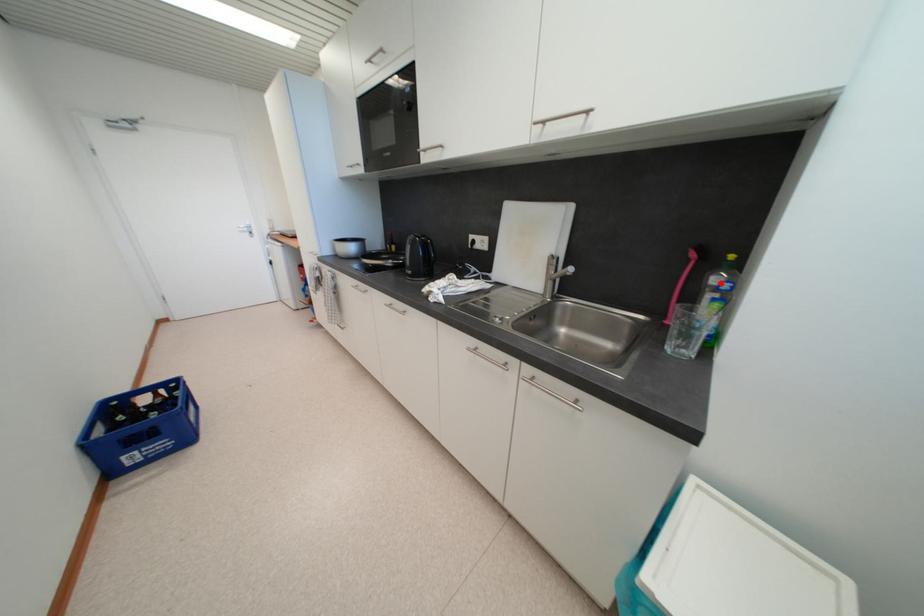
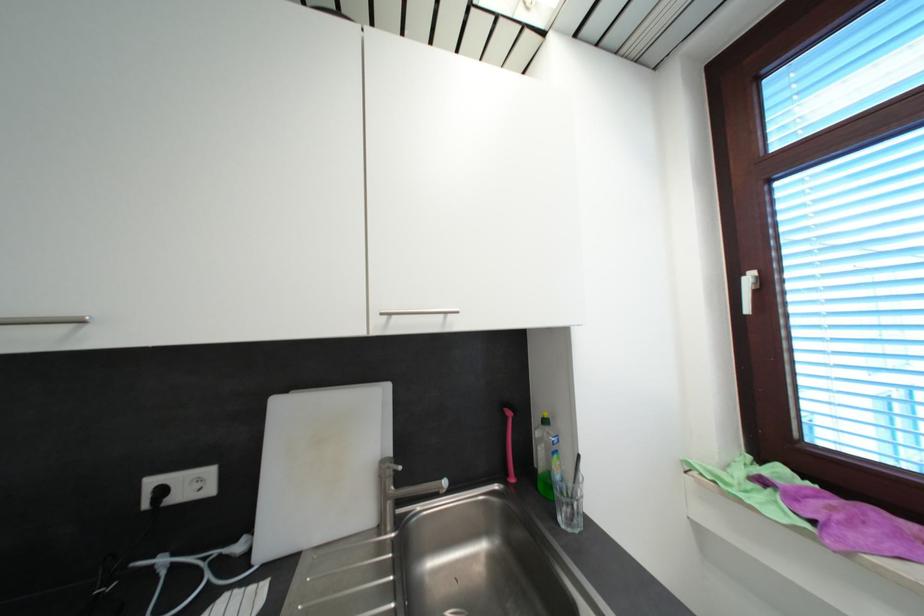
The point at the highlighted location is marked in the first image. Where is the corresponding point in the second image?

(542, 436)